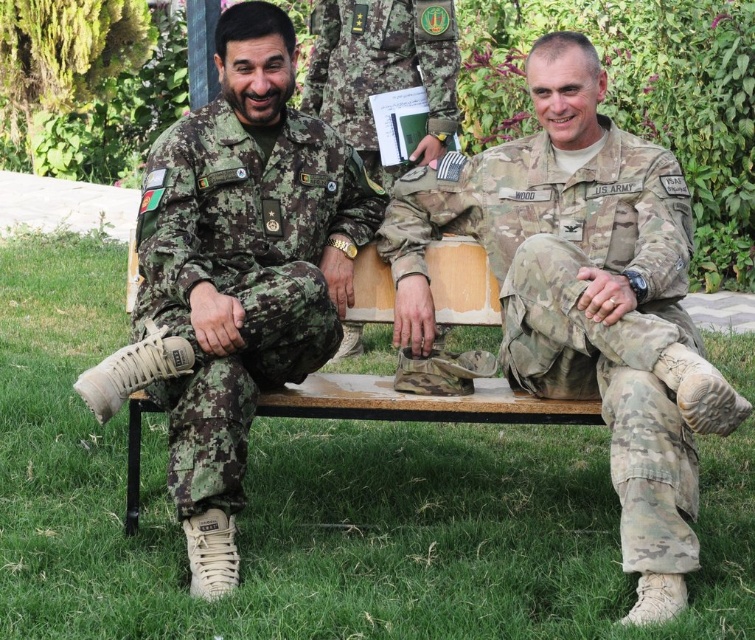
Does camouflage fabric pants at left have a lesser width compared to camouflage uniform at center?

Correct, camouflage fabric pants at left's width is less than camouflage uniform at center's.

Is point (267, 353) less distant than point (370, 164)?

Yes, it is in front of point (370, 164).

At what (x,y) coordinates should I click in order to perform the action: click on camouflage fabric pants at left. Please return your answer as a coordinate pair (x, y). Looking at the image, I should click on 242,275.

Is camouflage fabric pants at center below camouflage uniform at center?

Yes.

Which is in front, point (683, 433) or point (356, 35)?

Point (683, 433) is more forward.

Locate an element on the screen. camouflage fabric pants at center is located at coordinates (578, 298).

Measure the distance between point (676, 413) and camera.

They are 3.40 meters apart.

Does camouflage fabric pants at center have a greater height compared to camouflage fabric pants at left?

A: Yes, camouflage fabric pants at center is taller than camouflage fabric pants at left.

You are a GUI agent. You are given a task and a screenshot of the screen. Output one action in this format:
    pyautogui.click(x=<x>, y=<y>)
    Task: Click on the camouflage fabric pants at center
    This screenshot has height=640, width=755.
    Given the screenshot: What is the action you would take?
    pyautogui.click(x=578, y=298)